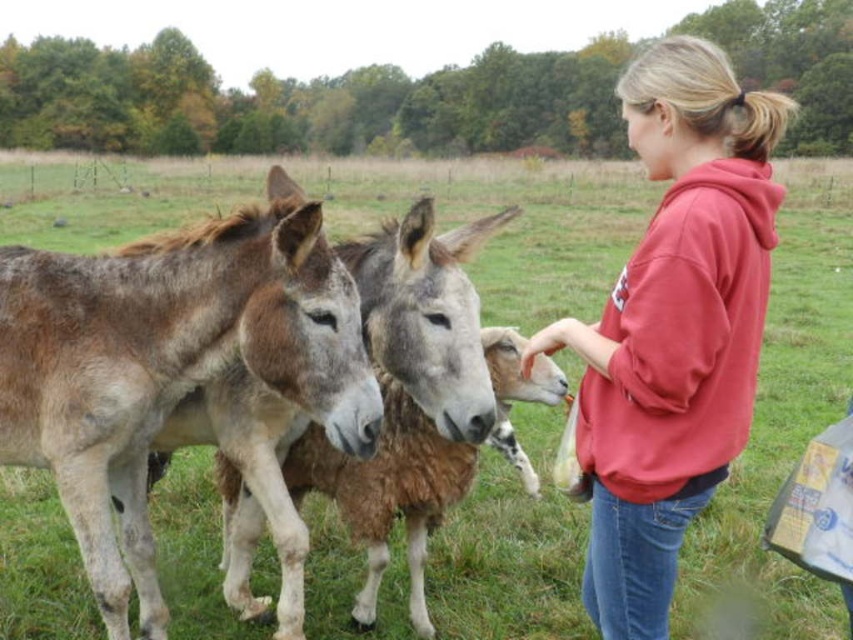
You are standing in the field and want to give the red fleece sweatshirt at center a bag of carrots. Which direction should you move to reach it first without passing the brown fuzzy mule at left?

The red fleece sweatshirt at center is to the right of the brown fuzzy mule at left, so you should move to the right to reach it without passing the brown fuzzy mule at left.

You are standing in the field and want to walk from point A to point B. Point A is located at coordinates point (50, 252) and point B is at point (618, 630). Since you can only move forward, will you be moving towards or away from the donkeys as you go from A to B?

Point (50, 252) is further to the viewer than point (618, 630). So moving from point A to point B means you are moving away from the donkeys.

You are a photographer trying to capture a clear shot of both the brown fuzzy mule at left and the red fleece sweatshirt at center. Based on their positions, which one is closer to the camera?

The brown fuzzy mule at left is closer to the camera since the red fleece sweatshirt at center is behind it.